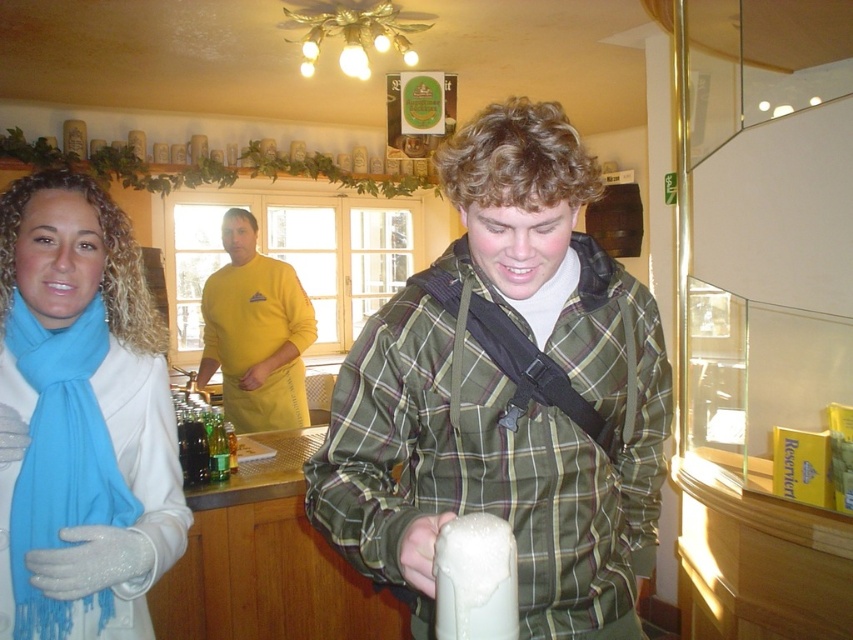
Between point (93, 320) and point (299, 326), which one is positioned in front?

Point (93, 320)

Can you confirm if turquoise soft scarf at left is positioned to the right of yellow fabric shirt at center?

Correct, you'll find turquoise soft scarf at left to the right of yellow fabric shirt at center.

Between point (16, 292) and point (285, 413), which one is positioned behind?

Positioned behind is point (285, 413).

The width and height of the screenshot is (853, 640). In order to click on turquoise soft scarf at left in this screenshot , I will do [61, 456].

Identify the location of turquoise soft scarf at left. This screenshot has width=853, height=640. (61, 456).

Is turquoise soft scarf at left bigger than green glass bottles at center?

No.

The image size is (853, 640). I want to click on turquoise soft scarf at left, so click(61, 456).

Does yellow fabric shirt at center have a smaller size compared to green glass bottles at center?

No, yellow fabric shirt at center is not smaller than green glass bottles at center.

Between yellow fabric shirt at center and green glass bottles at center, which one is positioned higher?

yellow fabric shirt at center

This screenshot has width=853, height=640. In order to click on yellow fabric shirt at center in this screenshot , I will do `click(254, 332)`.

You are a GUI agent. You are given a task and a screenshot of the screen. Output one action in this format:
    pyautogui.click(x=<x>, y=<y>)
    Task: Click on the yellow fabric shirt at center
    
    Given the screenshot: What is the action you would take?
    pyautogui.click(x=254, y=332)